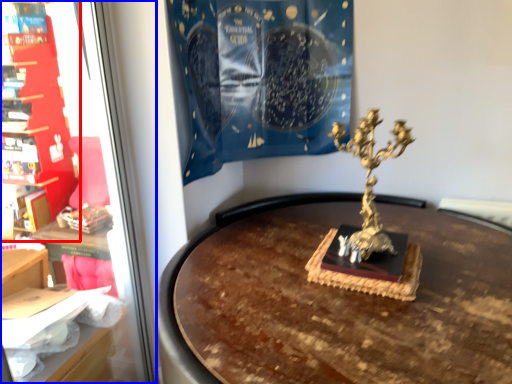
Question: Which object appears closest to the camera in this image, furniture (highlighted by a red box) or shop window (highlighted by a blue box)?

Choices:
 (A) furniture
 (B) shop window

Answer: (B)